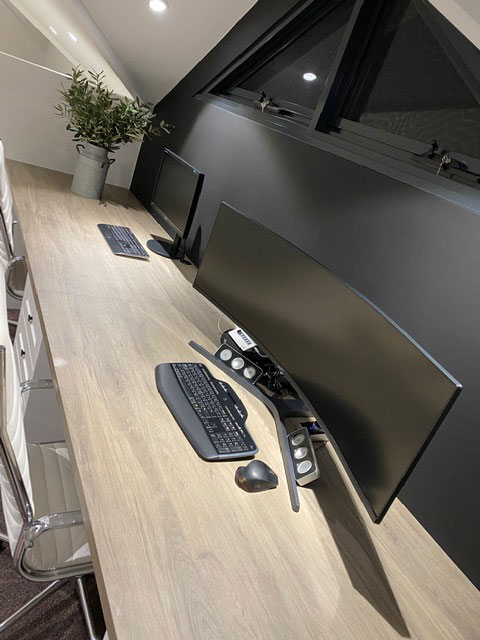
Locate an element on the screen. This screenshot has height=640, width=480. under desk set of drawers is located at coordinates (39, 422), (40, 367), (28, 336), (22, 370).